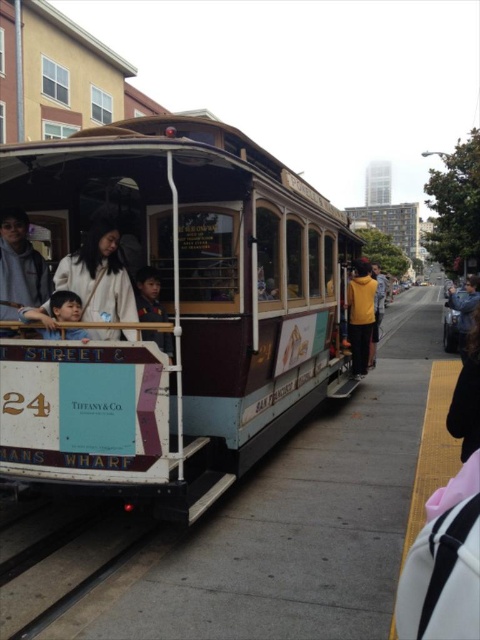
Is wooden polished cable car at center bigger than black metal train track at lower left?

Indeed, wooden polished cable car at center has a larger size compared to black metal train track at lower left.

Who is lower down, wooden polished cable car at center or black metal train track at lower left?

black metal train track at lower left is lower down.

Measure the distance between wooden polished cable car at center and camera.

wooden polished cable car at center is 3.54 meters away from camera.

This screenshot has height=640, width=480. Identify the location of wooden polished cable car at center. (173, 312).

Is wooden polished cable car at center above yellow matte jacket at center?

Incorrect, wooden polished cable car at center is not positioned above yellow matte jacket at center.

Does wooden polished cable car at center have a greater height compared to yellow matte jacket at center?

Indeed, wooden polished cable car at center has a greater height compared to yellow matte jacket at center.

Is point (323, 308) positioned after point (360, 321)?

No, it is not.

I want to click on wooden polished cable car at center, so click(x=173, y=312).

Can you confirm if black metal train track at lower left is wider than matte black shirt at center?

Correct, the width of black metal train track at lower left exceeds that of matte black shirt at center.

Can you confirm if black metal train track at lower left is positioned above matte black shirt at center?

No.

This screenshot has height=640, width=480. I want to click on black metal train track at lower left, so click(x=60, y=561).